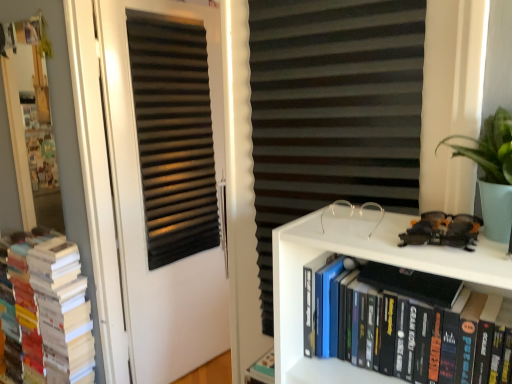
At what (x,y) coordinates should I click in order to perform the action: click on black matte curtain at upper center. Please return your answer as a coordinate pair (x, y). Looking at the image, I should click on (332, 111).

The width and height of the screenshot is (512, 384). Find the location of `black matte door at center`. black matte door at center is located at coordinates (144, 214).

Measure the distance between point (400, 234) and camera.

They are 38.03 inches apart.

Find the location of `black matte bookshelf at lower right, which is counted as the second book, starting from the left`. black matte bookshelf at lower right, which is counted as the second book, starting from the left is located at coordinates (418, 334).

Image resolution: width=512 pixels, height=384 pixels. Describe the element at coordinates (381, 214) in the screenshot. I see `clear plastic glasses at upper center` at that location.

Find the location of a particular element. black matte curtain at upper center is located at coordinates (332, 111).

Would you consider black matte door at center to be distant from black matte bookshelf at lower right, which is the 2th book in back-to-front order?

Yes.

Consider the image. From the image's perspective, is black matte door at center located above or below black matte bookshelf at lower right, which is the first book in right-to-left order?

black matte door at center is situated higher than black matte bookshelf at lower right, which is the first book in right-to-left order, in the image.

Looking at their sizes, would you say black matte door at center is wider or thinner than black matte bookshelf at lower right, which is counted as the second book, starting from the left?

Considering their sizes, black matte door at center looks slimmer than black matte bookshelf at lower right, which is counted as the second book, starting from the left.

Considering the sizes of objects black matte door at center and black matte bookshelf at lower right, which is the 1th book from front to back, in the image provided, who is shorter, black matte door at center or black matte bookshelf at lower right, which is the 1th book from front to back,?

black matte bookshelf at lower right, which is the 1th book from front to back.

Considering the sizes of clear plastic glasses at upper center and shiny plastic toy car at upper right in the image, is clear plastic glasses at upper center wider or thinner than shiny plastic toy car at upper right?

Considering their sizes, clear plastic glasses at upper center looks slimmer than shiny plastic toy car at upper right.

From a real-world perspective, is clear plastic glasses at upper center positioned above or below shiny plastic toy car at upper right?

Clearly, from a real-world perspective, clear plastic glasses at upper center is below shiny plastic toy car at upper right.

Is clear plastic glasses at upper center not close to shiny plastic toy car at upper right?

No.

Considering the relative sizes of clear plastic glasses at upper center and shiny plastic toy car at upper right in the image provided, is clear plastic glasses at upper center taller than shiny plastic toy car at upper right?

Yes.

Consider the image. From a real-world perspective, which is physically below, white paper books at left, which is counted as the second book, starting from the front, or black matte curtain at upper center?

From a 3D spatial view, white paper books at left, which is counted as the second book, starting from the front, is below.

From the picture: Is white paper books at left, placed as the first book when sorted from back to front, with black matte curtain at upper center?

No, white paper books at left, placed as the first book when sorted from back to front, is not in contact with black matte curtain at upper center.

Is white paper books at left, which appears as the 2th book when viewed from the right, not inside black matte curtain at upper center?

Yes, white paper books at left, which appears as the 2th book when viewed from the right, is outside of black matte curtain at upper center.

In the scene shown: Is white paper books at left, which appears as the 2th book when viewed from the right, bigger than black matte curtain at upper center?

Indeed, white paper books at left, which appears as the 2th book when viewed from the right, has a larger size compared to black matte curtain at upper center.

Based on their positions, is black matte door at center located to the left or right of clear plastic glasses at upper center?

black matte door at center is to the left of clear plastic glasses at upper center.

Is point (139, 262) in front of point (365, 204)?

No, (139, 262) is behind (365, 204).

From the image's perspective, is black matte door at center located beneath clear plastic glasses at upper center?

Yes, from the image's perspective, black matte door at center is below clear plastic glasses at upper center.

From the picture: Is black matte curtain at upper center taller than black matte door at center?

Incorrect, the height of black matte curtain at upper center is not larger of that of black matte door at center.

In the scene shown: Is black matte curtain at upper center wider than black matte door at center?

No, black matte curtain at upper center is not wider than black matte door at center.

Is black matte curtain at upper center further to the viewer compared to black matte door at center?

No, black matte curtain at upper center is in front of black matte door at center.

From the image's perspective, which object appears higher, black matte bookshelf at lower right, which is the 1th book from front to back, or shiny plastic toy car at upper right?

From the image's view, shiny plastic toy car at upper right is above.

Considering the sizes of objects black matte bookshelf at lower right, which is the 2th book in back-to-front order, and shiny plastic toy car at upper right in the image provided, who is bigger, black matte bookshelf at lower right, which is the 2th book in back-to-front order, or shiny plastic toy car at upper right?

Bigger between the two is black matte bookshelf at lower right, which is the 2th book in back-to-front order.

Which of these two, black matte bookshelf at lower right, which is the 2th book in back-to-front order, or shiny plastic toy car at upper right, is thinner?

shiny plastic toy car at upper right.

Is black matte curtain at upper center facing towards black matte bookshelf at lower right, which is the 1th book from front to back?

Yes, black matte curtain at upper center is aimed at black matte bookshelf at lower right, which is the 1th book from front to back.

From a real-world perspective, is black matte curtain at upper center located beneath black matte bookshelf at lower right, which is the 1th book from front to back?

No, from a real-world perspective, black matte curtain at upper center is not under black matte bookshelf at lower right, which is the 1th book from front to back.

Consider the image. What's the angular difference between black matte curtain at upper center and black matte bookshelf at lower right, which is counted as the second book, starting from the left,'s facing directions?

4.04 degrees separate the facing orientations of black matte curtain at upper center and black matte bookshelf at lower right, which is counted as the second book, starting from the left.

What are the coordinates of `door located on the left of black matte bookshelf at lower right, which is counted as the second book, starting from the left` in the screenshot? It's located at (144, 214).

The height and width of the screenshot is (384, 512). Identify the location of toy car below the clear plastic glasses at upper center (from the image's perspective). (443, 230).

From the image, which object appears to be nearer to clear plastic glasses at upper center, black matte door at center or black matte curtain at upper center?

Based on the image, black matte curtain at upper center appears to be nearer to clear plastic glasses at upper center.

Which object lies further to the anchor point black matte bookshelf at lower right, which is the 2th book in back-to-front order, clear plastic glasses at upper center or shiny plastic toy car at upper right?

clear plastic glasses at upper center is positioned further to the anchor black matte bookshelf at lower right, which is the 2th book in back-to-front order.

Looking at the image, which one is located closer to shiny plastic toy car at upper right, black matte door at center or black matte bookshelf at lower right, which is the 2th book in back-to-front order?

black matte bookshelf at lower right, which is the 2th book in back-to-front order.

Which object lies further to the anchor point black matte door at center, black matte bookshelf at lower right, which is the 2th book in back-to-front order, or black matte curtain at upper center?

black matte bookshelf at lower right, which is the 2th book in back-to-front order.

Estimate the real-world distances between objects in this image. Which object is closer to shiny plastic toy car at upper right, white paper books at left, which is counted as the 1th book, starting from the left, or black matte bookshelf at lower right, which is the first book in right-to-left order?

The object closer to shiny plastic toy car at upper right is black matte bookshelf at lower right, which is the first book in right-to-left order.

Based on their spatial positions, is shiny plastic toy car at upper right or black matte curtain at upper center further from white paper books at left, which appears as the 2th book when viewed from the right?

shiny plastic toy car at upper right is positioned further to the anchor white paper books at left, which appears as the 2th book when viewed from the right.

Which object lies nearer to the anchor point clear plastic glasses at upper center, shiny plastic toy car at upper right or white paper books at left, placed as the first book when sorted from back to front?

shiny plastic toy car at upper right lies closer to clear plastic glasses at upper center than the other object.

Considering their positions, is black matte curtain at upper center positioned closer to shiny plastic toy car at upper right than black matte door at center?

black matte curtain at upper center.

Image resolution: width=512 pixels, height=384 pixels. What are the coordinates of `door situated between white paper books at left, which is counted as the second book, starting from the front, and black matte bookshelf at lower right, which is the 2th book in back-to-front order, from left to right` in the screenshot? It's located at (144, 214).

I want to click on toy car between clear plastic glasses at upper center and black matte bookshelf at lower right, which is the 1th book from front to back, in the up-down direction, so click(443, 230).

Locate an element on the screen. Image resolution: width=512 pixels, height=384 pixels. curtain that lies between clear plastic glasses at upper center and black matte bookshelf at lower right, which is counted as the second book, starting from the left, from top to bottom is located at coordinates (332, 111).

This screenshot has height=384, width=512. Find the location of `curtain between white paper books at left, placed as the first book when sorted from back to front, and black matte bookshelf at lower right, which is the 2th book in back-to-front order, in the horizontal direction`. curtain between white paper books at left, placed as the first book when sorted from back to front, and black matte bookshelf at lower right, which is the 2th book in back-to-front order, in the horizontal direction is located at coordinates (332, 111).